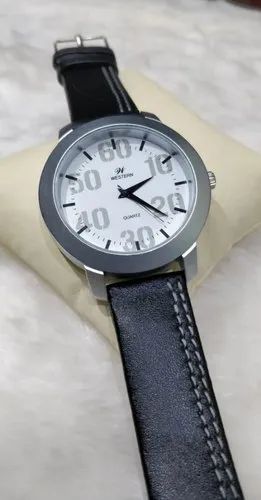
Where is `white clockface`? This screenshot has width=261, height=500. white clockface is located at coordinates (109, 201).